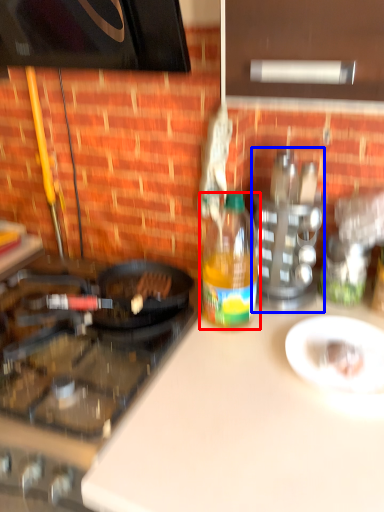
Question: Among these objects, which one is nearest to the camera, bottle (highlighted by a red box) or appliance (highlighted by a blue box)?

Choices:
 (A) bottle
 (B) appliance

Answer: (A)